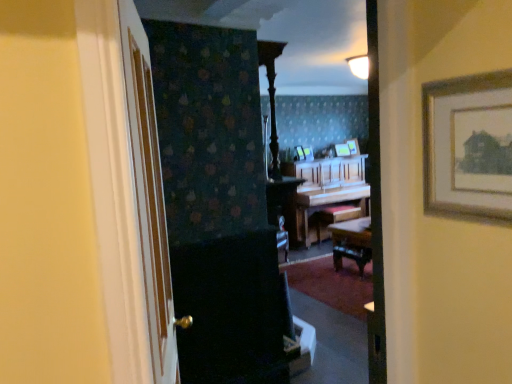
How much space does wooden picture frame at center, marked as the third picture frame in a left-to-right arrangement, occupy vertically?

The height of wooden picture frame at center, marked as the third picture frame in a left-to-right arrangement, is 19.89 centimeters.

This screenshot has width=512, height=384. Describe the element at coordinates (342, 150) in the screenshot. I see `wooden picture frame at center, which is the 2th picture frame from right to left` at that location.

Describe the element at coordinates (323, 192) in the screenshot. I see `wooden piano at center` at that location.

The width and height of the screenshot is (512, 384). I want to click on wooden picture frame at center, marked as the second picture frame in a left-to-right arrangement, so click(x=308, y=153).

I want to click on white wood door at left, so coord(150,197).

What do you see at coordinates (300, 153) in the screenshot? I see `metallic silver picture frame at center, which is the first picture frame from left to right` at bounding box center [300, 153].

At what (x,y) coordinates should I click in order to perform the action: click on wooden picture frame at center, marked as the third picture frame in a left-to-right arrangement. Please return your answer as a coordinate pair (x, y). The image size is (512, 384). Looking at the image, I should click on (342, 150).

From the image's perspective, does wooden picture frame at center, placed as the 1th picture frame when sorted from right to left, appear lower than wooden picture frame at center, which is counted as the 3th picture frame, starting from the right?

No, from the image's perspective, wooden picture frame at center, placed as the 1th picture frame when sorted from right to left, is not below wooden picture frame at center, which is counted as the 3th picture frame, starting from the right.

Does wooden picture frame at center, which is the fourth picture frame in left-to-right order, turn towards wooden picture frame at center, marked as the second picture frame in a left-to-right arrangement?

No, wooden picture frame at center, which is the fourth picture frame in left-to-right order, is not turned towards wooden picture frame at center, marked as the second picture frame in a left-to-right arrangement.

Between wooden picture frame at center, placed as the 1th picture frame when sorted from right to left, and wooden picture frame at center, which is counted as the 3th picture frame, starting from the right, which one has smaller size?

wooden picture frame at center, which is counted as the 3th picture frame, starting from the right, is smaller.

From a real-world perspective, is wooden picture frame at center, placed as the 1th picture frame when sorted from right to left, on top of wooden picture frame at center, which is counted as the 3th picture frame, starting from the right?

Indeed, from a real-world perspective, wooden picture frame at center, placed as the 1th picture frame when sorted from right to left, stands above wooden picture frame at center, which is counted as the 3th picture frame, starting from the right.

Can you tell me how much wooden picture frame at center, placed as the 1th picture frame when sorted from right to left, and metallic silver picture frame at center, which is the first picture frame from left to right, differ in facing direction?

The angular difference between wooden picture frame at center, placed as the 1th picture frame when sorted from right to left, and metallic silver picture frame at center, which is the first picture frame from left to right, is 29.8 degrees.

Could you tell me if wooden picture frame at center, placed as the 1th picture frame when sorted from right to left, is turned towards metallic silver picture frame at center, which is the first picture frame from left to right?

No.

Is wooden picture frame at center, placed as the 1th picture frame when sorted from right to left, wider than metallic silver picture frame at center, which is the first picture frame from left to right?

In fact, wooden picture frame at center, placed as the 1th picture frame when sorted from right to left, might be narrower than metallic silver picture frame at center, which is the first picture frame from left to right.

Can you confirm if white wood door at left is thinner than wooden picture frame at center, which is the 2th picture frame from right to left?

No, white wood door at left is not thinner than wooden picture frame at center, which is the 2th picture frame from right to left.

Considering the positions of objects white wood door at left and wooden picture frame at center, which is the 2th picture frame from right to left, in the image provided, who is more to the right, white wood door at left or wooden picture frame at center, which is the 2th picture frame from right to left,?

From the viewer's perspective, wooden picture frame at center, which is the 2th picture frame from right to left, appears more on the right side.

From a real-world perspective, which object rests below the other?

white wood door at left.

Looking at this image, relative to wooden picture frame at center, which is the 2th picture frame from right to left, is white wood door at left in front or behind?

In the image, white wood door at left appears in front of wooden picture frame at center, which is the 2th picture frame from right to left.

Is metallic silver picture frame at center, which is the first picture frame from left to right, wider than wooden piano at center?

Incorrect, the width of metallic silver picture frame at center, which is the first picture frame from left to right, does not surpass that of wooden piano at center.

From a real-world perspective, who is located higher, metallic silver picture frame at center, which is the first picture frame from left to right, or wooden piano at center?

metallic silver picture frame at center, which is the first picture frame from left to right.

Is metallic silver picture frame at center, which is the first picture frame from left to right, taller or shorter than wooden piano at center?

Considering their sizes, metallic silver picture frame at center, which is the first picture frame from left to right, has less height than wooden piano at center.

Is wooden piano at center beside wooden picture frame at center, marked as the second picture frame in a left-to-right arrangement?

No, wooden piano at center is not with wooden picture frame at center, marked as the second picture frame in a left-to-right arrangement.

Is wooden piano at center facing away from wooden picture frame at center, marked as the second picture frame in a left-to-right arrangement?

wooden piano at center does not have its back to wooden picture frame at center, marked as the second picture frame in a left-to-right arrangement.

This screenshot has height=384, width=512. Find the location of `cabinetry on the right of the wooden picture frame at center, marked as the second picture frame in a left-to-right arrangement`. cabinetry on the right of the wooden picture frame at center, marked as the second picture frame in a left-to-right arrangement is located at coordinates (323, 192).

Is wooden piano at center at the left side of wooden picture frame at center, which is counted as the 3th picture frame, starting from the right?

In fact, wooden piano at center is to the right of wooden picture frame at center, which is counted as the 3th picture frame, starting from the right.

Does point (295, 148) appear closer or farther from the camera than point (306, 154)?

Point (295, 148) is closer to the camera than point (306, 154).

Are metallic silver picture frame at center, which is the first picture frame from left to right, and wooden picture frame at center, which is counted as the 3th picture frame, starting from the right, beside each other?

Yes, metallic silver picture frame at center, which is the first picture frame from left to right, and wooden picture frame at center, which is counted as the 3th picture frame, starting from the right, clearly make contact.

Locate an element on the screen. This screenshot has height=384, width=512. picture frame on the left of wooden picture frame at center, marked as the second picture frame in a left-to-right arrangement is located at coordinates (300, 153).

Does metallic silver picture frame at center, the fourth picture frame from the right, contain wooden picture frame at center, which is counted as the 3th picture frame, starting from the right?

No.

Based on the photo, is wooden picture frame at center, placed as the 1th picture frame when sorted from right to left, oriented away from wooden piano at center?

No.

From the image's perspective, is wooden picture frame at center, which is the fourth picture frame in left-to-right order, on wooden piano at center?

Indeed, from the image's perspective, wooden picture frame at center, which is the fourth picture frame in left-to-right order, is shown above wooden piano at center.

From a real-world perspective, is wooden picture frame at center, placed as the 1th picture frame when sorted from right to left, beneath wooden piano at center?

Actually, wooden picture frame at center, placed as the 1th picture frame when sorted from right to left, is physically above wooden piano at center in the real world.

How far apart are wooden picture frame at center, which is the fourth picture frame in left-to-right order, and wooden piano at center?

The distance of wooden picture frame at center, which is the fourth picture frame in left-to-right order, from wooden piano at center is 32.62 inches.

The height and width of the screenshot is (384, 512). I want to click on the 2nd picture frame behind the wooden picture frame at center, marked as the second picture frame in a left-to-right arrangement, so click(x=353, y=146).

Find the location of `the 3rd picture frame counting from the left side of the wooden picture frame at center, which is the fourth picture frame in left-to-right order`. the 3rd picture frame counting from the left side of the wooden picture frame at center, which is the fourth picture frame in left-to-right order is located at coordinates (300, 153).

From the image, which object appears to be farther from wooden picture frame at center, placed as the 1th picture frame when sorted from right to left, wooden piano at center or wooden picture frame at center, which is the 2th picture frame from right to left?

Among the two, wooden piano at center is located further to wooden picture frame at center, placed as the 1th picture frame when sorted from right to left.

Estimate the real-world distances between objects in this image. Which object is closer to white wood door at left, wooden picture frame at center, marked as the second picture frame in a left-to-right arrangement, or wooden picture frame at center, placed as the 1th picture frame when sorted from right to left?

The object closer to white wood door at left is wooden picture frame at center, marked as the second picture frame in a left-to-right arrangement.

Looking at the image, which one is located further to wooden picture frame at center, which is the 2th picture frame from right to left, metallic silver picture frame at center, which is the first picture frame from left to right, or wooden picture frame at center, marked as the second picture frame in a left-to-right arrangement?

metallic silver picture frame at center, which is the first picture frame from left to right, is positioned further to the anchor wooden picture frame at center, which is the 2th picture frame from right to left.

Looking at the image, which one is located further to white wood door at left, metallic silver picture frame at center, the fourth picture frame from the right, or wooden piano at center?

metallic silver picture frame at center, the fourth picture frame from the right, is further to white wood door at left.

In the scene shown: Considering their positions, is wooden piano at center positioned further to wooden picture frame at center, placed as the 1th picture frame when sorted from right to left, than wooden picture frame at center, marked as the second picture frame in a left-to-right arrangement?

wooden piano at center.

Based on their spatial positions, is wooden piano at center or white wood door at left closer to wooden picture frame at center, marked as the second picture frame in a left-to-right arrangement?

Based on the image, wooden piano at center appears to be nearer to wooden picture frame at center, marked as the second picture frame in a left-to-right arrangement.

Based on their spatial positions, is metallic silver picture frame at center, which is the first picture frame from left to right, or wooden picture frame at center, which is the fourth picture frame in left-to-right order, closer to wooden piano at center?

The object closer to wooden piano at center is metallic silver picture frame at center, which is the first picture frame from left to right.

Considering their positions, is white wood door at left positioned further to metallic silver picture frame at center, which is the first picture frame from left to right, than wooden piano at center?

Among the two, white wood door at left is located further to metallic silver picture frame at center, which is the first picture frame from left to right.

Find the location of a particular element. This screenshot has height=384, width=512. cabinetry between white wood door at left and metallic silver picture frame at center, which is the first picture frame from left to right, in the front-back direction is located at coordinates (323, 192).

The width and height of the screenshot is (512, 384). Find the location of `picture frame that lies between wooden picture frame at center, which is counted as the 3th picture frame, starting from the right, and wooden piano at center from top to bottom`. picture frame that lies between wooden picture frame at center, which is counted as the 3th picture frame, starting from the right, and wooden piano at center from top to bottom is located at coordinates (300, 153).

Where is `picture frame situated between wooden picture frame at center, which is counted as the 3th picture frame, starting from the right, and wooden picture frame at center, placed as the 1th picture frame when sorted from right to left, from left to right`? Image resolution: width=512 pixels, height=384 pixels. picture frame situated between wooden picture frame at center, which is counted as the 3th picture frame, starting from the right, and wooden picture frame at center, placed as the 1th picture frame when sorted from right to left, from left to right is located at coordinates (342, 150).

Identify the location of picture frame located between white wood door at left and wooden picture frame at center, which is counted as the 3th picture frame, starting from the right, in the depth direction. (300, 153).